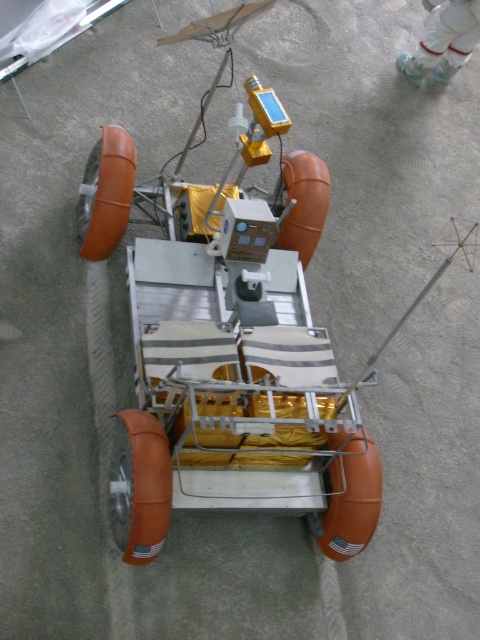
Can you confirm if metallic silver rover at center is smaller than white fabric suit at upper center?

Incorrect, metallic silver rover at center is not smaller in size than white fabric suit at upper center.

Between point (313, 380) and point (437, 26), which one is positioned in front?

Point (313, 380)

The image size is (480, 640). I want to click on metallic silver rover at center, so click(233, 349).